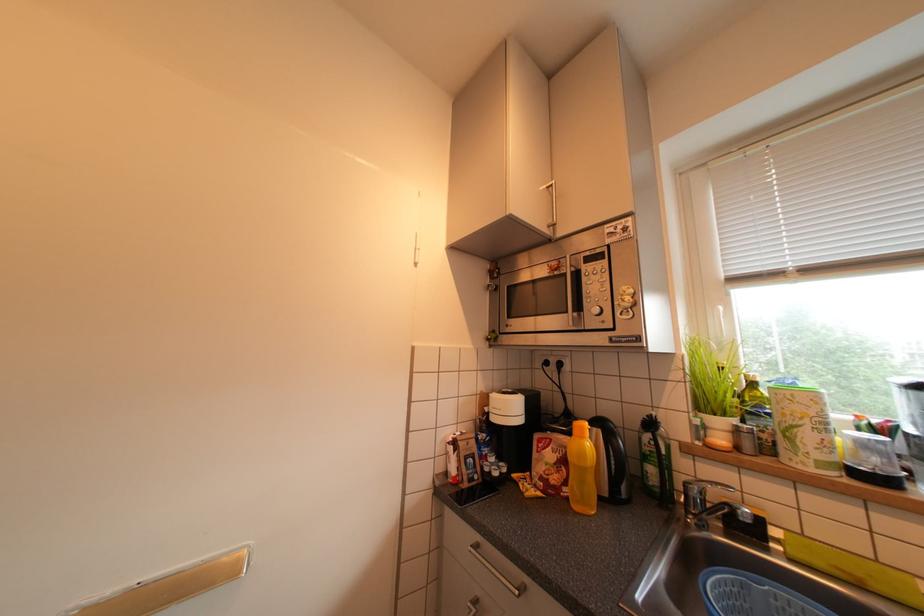
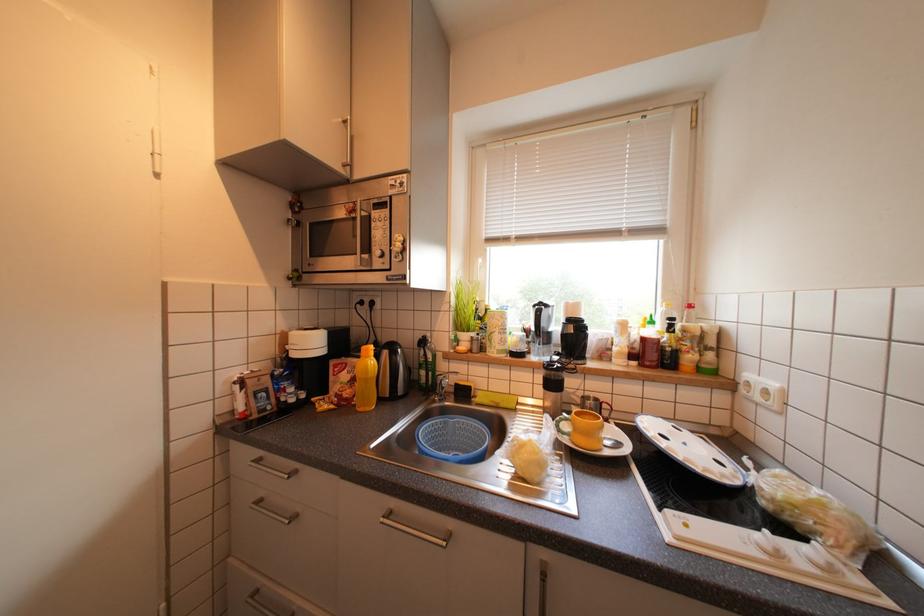
Question: The first image is from the beginning of the video and the second image is from the end. How did the camera likely rotate when shooting the video?

Choices:
 (A) Left
 (B) Right
 (C) Up
 (D) Down

Answer: (B)